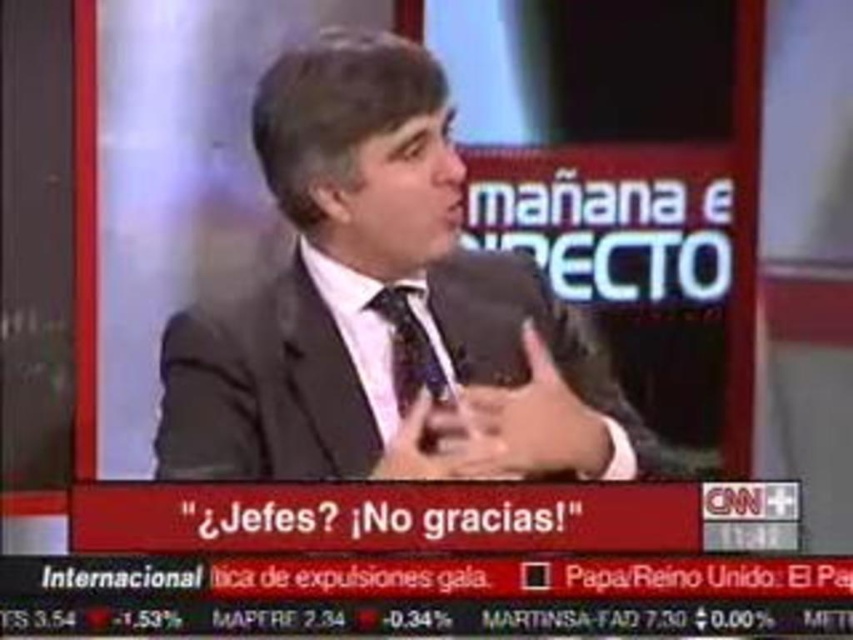
Based on the photo, you are a fashion designer observing the matte black suit at center and the patterned silk tie at center. Which item is wider?

The matte black suit at center is wider than the patterned silk tie at center.

You are a camera operator adjusting the focus on a television studio camera. You need to ensure both the matte black suit at center and the patterned silk tie at center are in focus. Which object should you focus on first to ensure both are sharp?

The matte black suit at center is closer to the viewer than the patterned silk tie at center, so focus on the matte black suit at center first to ensure both are in focus.